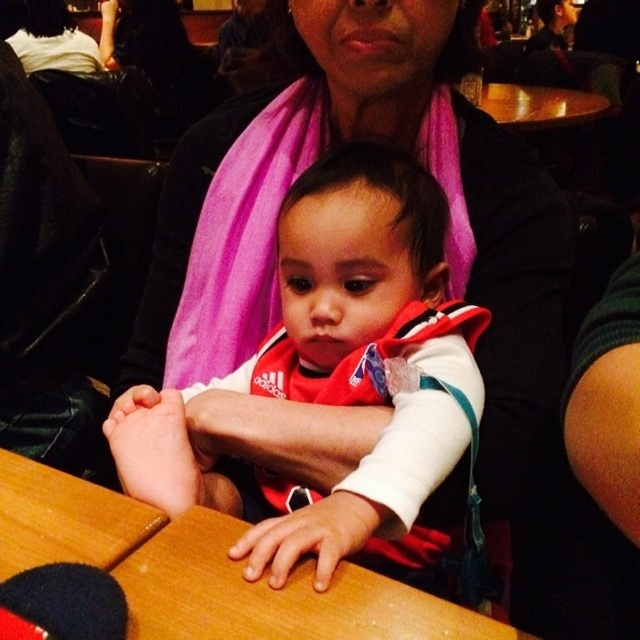
Who is more distant from viewer, (x=376, y=474) or (x=364, y=573)?

Point (x=376, y=474)

Which of these two, white matte baby at center or wooden table at center, stands taller?

white matte baby at center is taller.

Is point (312, 524) more distant than point (32, 532)?

No.

The width and height of the screenshot is (640, 640). Identify the location of white matte baby at center. (339, 371).